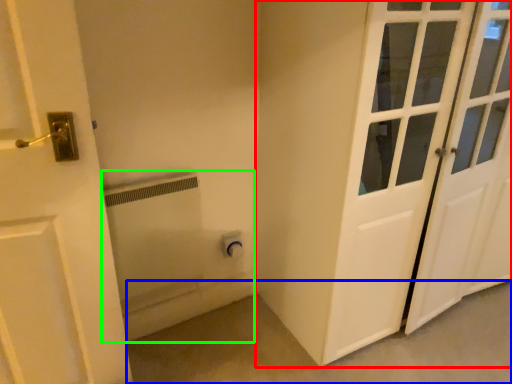
Question: Which object is the farthest from door (highlighted by a red box)? Choose among these: concrete (highlighted by a blue box) or bath (highlighted by a green box).

Choices:
 (A) concrete
 (B) bath

Answer: (B)